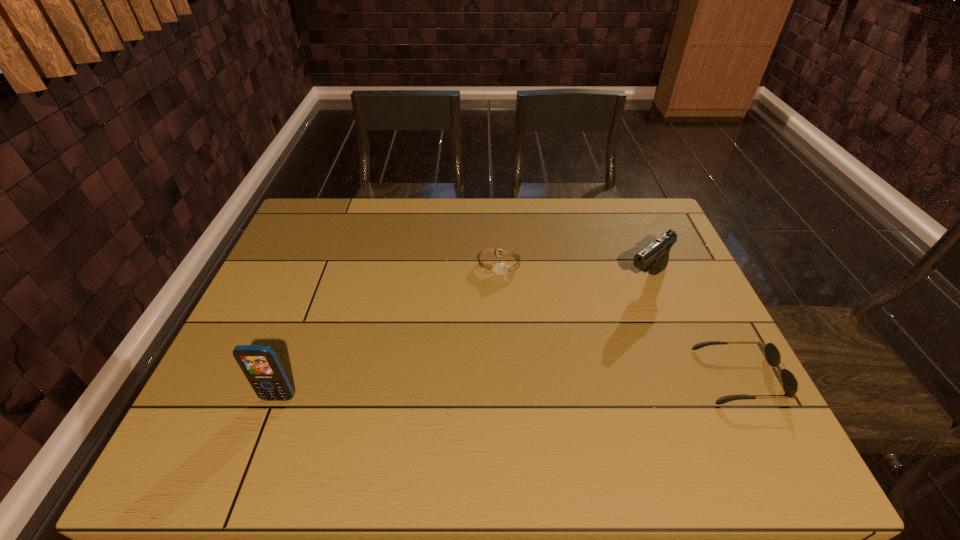
In the image, there is a desktop. At what (x,y) coordinates should I click in order to perform the action: click on vacant space at the left edge. Please return your answer as a coordinate pair (x, y). Looking at the image, I should click on (292, 305).

Find the location of a particular element. The width and height of the screenshot is (960, 540). free space at the right edge is located at coordinates (729, 384).

Where is `vacant space at the far right corner of the desktop`? vacant space at the far right corner of the desktop is located at coordinates (639, 212).

This screenshot has height=540, width=960. What are the coordinates of `free space between the third shortest object and the cellular telephone` in the screenshot? It's located at (463, 338).

In order to click on vacant space in between the leftmost object and the second object from left to right in this screenshot , I will do `click(389, 332)`.

Find the location of a particular element. free area in between the pistol and the third object from right to left is located at coordinates (573, 272).

Identify the location of vacant region between the sunglasses and the third object from right to left. (619, 321).

The height and width of the screenshot is (540, 960). What are the coordinates of `vacant area that lies between the tallest object and the third shortest object` in the screenshot? It's located at (463, 338).

Locate an element on the screen. free space that is in between the leftmost object and the second object from left to right is located at coordinates (389, 332).

Find the location of a particular element. free spot between the second object from left to right and the second tallest object is located at coordinates (573, 272).